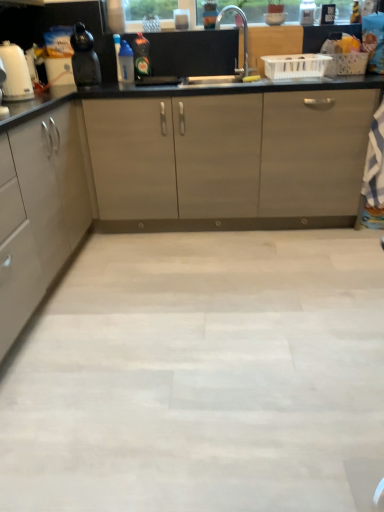
The width and height of the screenshot is (384, 512). What do you see at coordinates (126, 62) in the screenshot?
I see `blue plastic bottle at upper center, marked as the 1th bottle in a left-to-right arrangement` at bounding box center [126, 62].

Find the location of a particular element. The width and height of the screenshot is (384, 512). silver metallic faucet at upper center is located at coordinates (244, 30).

The width and height of the screenshot is (384, 512). Find the location of `matte gray cabinet at left`. matte gray cabinet at left is located at coordinates (39, 212).

Locate an element on the screen. The height and width of the screenshot is (512, 384). white glossy kettle at left is located at coordinates (15, 73).

Is there a large distance between green glass bottle at center, the 2th bottle positioned from the left, and silver metallic faucet at upper center?

No, green glass bottle at center, the 2th bottle positioned from the left, is in close proximity to silver metallic faucet at upper center.

Which of these two, green glass bottle at center, the 2th bottle positioned from the left, or silver metallic faucet at upper center, stands taller?

silver metallic faucet at upper center.

Is green glass bottle at center, acting as the 1th bottle starting from the right, to the left or to the right of silver metallic faucet at upper center in the image?

green glass bottle at center, acting as the 1th bottle starting from the right, is positioned on silver metallic faucet at upper center's left side.

From the image's perspective, relative to silver metallic faucet at upper center, is green glass bottle at center, the 2th bottle positioned from the left, above or below?

green glass bottle at center, the 2th bottle positioned from the left, is below silver metallic faucet at upper center.

Could you measure the distance between matte gray cabinet at left and blue plastic bottle at upper center, the second bottle in the right-to-left sequence?

The distance of matte gray cabinet at left from blue plastic bottle at upper center, the second bottle in the right-to-left sequence, is 3.96 feet.

Is matte gray cabinet at left at the right side of blue plastic bottle at upper center, the second bottle in the right-to-left sequence?

No.

Which of these two, matte gray cabinet at left or blue plastic bottle at upper center, marked as the 1th bottle in a left-to-right arrangement, stands shorter?

Standing shorter between the two is blue plastic bottle at upper center, marked as the 1th bottle in a left-to-right arrangement.

From a real-world perspective, who is located higher, matte gray cabinet at left or blue plastic bottle at upper center, marked as the 1th bottle in a left-to-right arrangement?

blue plastic bottle at upper center, marked as the 1th bottle in a left-to-right arrangement, is physically above.

Measure the distance from silver metallic faucet at upper center to matte gray cabinet at left.

silver metallic faucet at upper center is 1.60 meters away from matte gray cabinet at left.

Which of these two, silver metallic faucet at upper center or matte gray cabinet at left, is thinner?

With smaller width is silver metallic faucet at upper center.

Would you say silver metallic faucet at upper center is a long distance from matte gray cabinet at left?

silver metallic faucet at upper center is far away from matte gray cabinet at left.

Is silver metallic faucet at upper center looking in the opposite direction of matte gray cabinet at left?

No.

Which of these two, white glossy kettle at left or silver metallic faucet at upper center, is bigger?

silver metallic faucet at upper center is bigger.

Which point is more distant from viewer, (21, 65) or (243, 22)?

The point (243, 22) is farther.

From the picture: Does white glossy kettle at left have a lesser height compared to silver metallic faucet at upper center?

Yes, white glossy kettle at left is shorter than silver metallic faucet at upper center.

Considering the relative positions of white glossy kettle at left and silver metallic faucet at upper center in the image provided, is white glossy kettle at left to the left or to the right of silver metallic faucet at upper center?

white glossy kettle at left is to the left of silver metallic faucet at upper center.

Considering the sizes of matte black kettle at left and matte gray cabinet at left in the image, is matte black kettle at left wider or thinner than matte gray cabinet at left?

Clearly, matte black kettle at left has less width compared to matte gray cabinet at left.

Is point (90, 72) closer or farther from the camera than point (41, 163)?

Clearly, point (90, 72) is more distant from the camera than point (41, 163).

This screenshot has width=384, height=512. What are the coordinates of `kitchen appliance above the matte gray cabinet at left (from a real-world perspective)` in the screenshot? It's located at (84, 57).

Is the position of matte black kettle at left more distant than that of matte gray cabinet at left?

Yes, matte black kettle at left is further from the viewer.

Looking at this image, does green glass bottle at center, the 2th bottle positioned from the left, have a greater height compared to matte gray cabinet at left?

In fact, green glass bottle at center, the 2th bottle positioned from the left, may be shorter than matte gray cabinet at left.

From the picture: Could you tell me if green glass bottle at center, acting as the 1th bottle starting from the right, is facing matte gray cabinet at left?

No, green glass bottle at center, acting as the 1th bottle starting from the right, does not turn towards matte gray cabinet at left.

Is the surface of green glass bottle at center, acting as the 1th bottle starting from the right, in direct contact with matte gray cabinet at left?

green glass bottle at center, acting as the 1th bottle starting from the right, and matte gray cabinet at left are not in contact.

Find the location of a particular element. Image resolution: width=384 pixels, height=512 pixels. home appliance in front of the blue plastic bottle at upper center, marked as the 1th bottle in a left-to-right arrangement is located at coordinates (15, 73).

From the picture: From a real-world perspective, is blue plastic bottle at upper center, marked as the 1th bottle in a left-to-right arrangement, positioned over white glossy kettle at left based on gravity?

Actually, blue plastic bottle at upper center, marked as the 1th bottle in a left-to-right arrangement, is physically below white glossy kettle at left in the real world.

Can you confirm if blue plastic bottle at upper center, the second bottle in the right-to-left sequence, is thinner than white glossy kettle at left?

Yes.

Can you confirm if blue plastic bottle at upper center, marked as the 1th bottle in a left-to-right arrangement, is smaller than white glossy kettle at left?

Yes.

This screenshot has height=512, width=384. Find the location of `faucet in front of the green glass bottle at center, acting as the 1th bottle starting from the right`. faucet in front of the green glass bottle at center, acting as the 1th bottle starting from the right is located at coordinates (244, 30).

This screenshot has height=512, width=384. I want to click on cabinetry on the left of blue plastic bottle at upper center, the second bottle in the right-to-left sequence, so click(x=39, y=212).

Considering their positions, is matte gray cabinet at left positioned closer to white glossy kettle at left than silver metallic faucet at upper center?

matte gray cabinet at left is positioned closer to the anchor white glossy kettle at left.

Considering their positions, is matte black kettle at left positioned closer to white glossy kettle at left than silver metallic faucet at upper center?

matte black kettle at left is closer to white glossy kettle at left.

Estimate the real-world distances between objects in this image. Which object is further from matte black kettle at left, matte gray cabinet at left or white glossy kettle at left?

matte gray cabinet at left lies further to matte black kettle at left than the other object.

Based on their spatial positions, is white glossy kettle at left or matte black kettle at left closer to blue plastic bottle at upper center, marked as the 1th bottle in a left-to-right arrangement?

matte black kettle at left lies closer to blue plastic bottle at upper center, marked as the 1th bottle in a left-to-right arrangement, than the other object.

Considering their positions, is matte black kettle at left positioned closer to matte gray cabinet at left than white glossy kettle at left?

Based on the image, white glossy kettle at left appears to be nearer to matte gray cabinet at left.

When comparing their distances from matte gray cabinet at left, does matte black kettle at left or green glass bottle at center, acting as the 1th bottle starting from the right, seem closer?

matte black kettle at left lies closer to matte gray cabinet at left than the other object.

Which object lies further to the anchor point green glass bottle at center, acting as the 1th bottle starting from the right, white glossy kettle at left or matte black kettle at left?

white glossy kettle at left is positioned further to the anchor green glass bottle at center, acting as the 1th bottle starting from the right.

Which object lies further to the anchor point matte black kettle at left, blue plastic bottle at upper center, the second bottle in the right-to-left sequence, or green glass bottle at center, acting as the 1th bottle starting from the right?

The object further to matte black kettle at left is green glass bottle at center, acting as the 1th bottle starting from the right.

You are a GUI agent. You are given a task and a screenshot of the screen. Output one action in this format:
    pyautogui.click(x=<x>, y=<y>)
    Task: Click on the home appliance between matte gray cabinet at left and matte black kettle at left from front to back
    
    Given the screenshot: What is the action you would take?
    pyautogui.click(x=15, y=73)

In order to click on home appliance located between matte gray cabinet at left and green glass bottle at center, acting as the 1th bottle starting from the right, in the depth direction in this screenshot , I will do `click(15, 73)`.

Locate an element on the screen. faucet positioned between matte gray cabinet at left and green glass bottle at center, the 2th bottle positioned from the left, from near to far is located at coordinates 244,30.

Locate an element on the screen. Image resolution: width=384 pixels, height=512 pixels. kitchen appliance located between white glossy kettle at left and silver metallic faucet at upper center in the left-right direction is located at coordinates tap(84, 57).